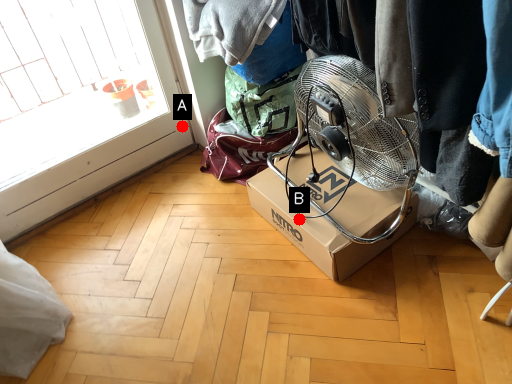
Question: Two points are circled on the image, labeled by A and B beside each circle. Which point is farther from the camera taking this photo?

Choices:
 (A) A is further
 (B) B is further

Answer: (A)